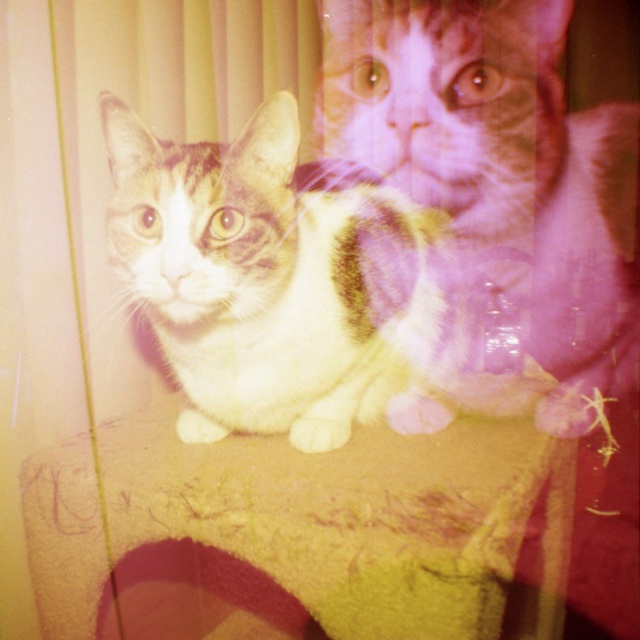
You are taking a photo of two cats at a pet adoption event. The cats are positioned at the center of the frame. The white fur cat at center is partially covering the calico fur cat at center. Based on their sizes, which cat is more likely to be in the foreground?

The white fur cat at center has a lesser width compared to calico fur cat at center, so the smaller white fur cat is likely in front, partially covering the larger calico fur cat.

Consider the image. You are standing in front of the image and want to determine the position of the white fur cat at center. Can you tell me its coordinates?

The white fur cat at center is located at point (284, 291).